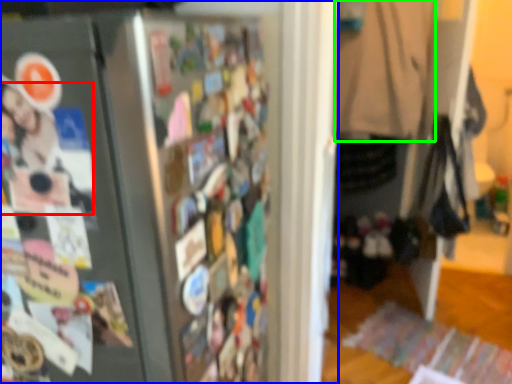
Question: Considering the real-world distances, which object is farthest from person (highlighted by a red box)? refrigerator (highlighted by a blue box) or clothing (highlighted by a green box)?

Choices:
 (A) refrigerator
 (B) clothing

Answer: (B)